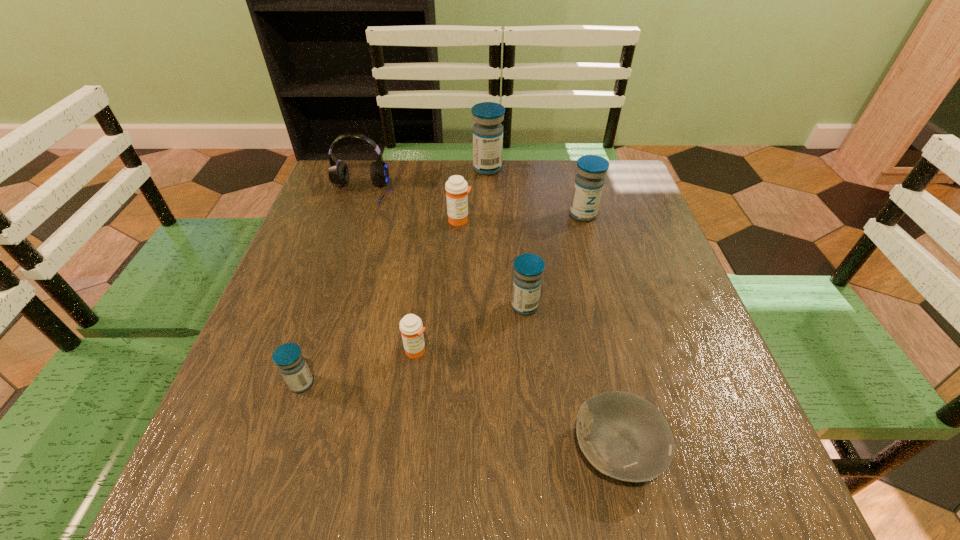
Select which medicine appears as the second closest to the nearest object. Please provide its 2D coordinates. Your answer should be formatted as a tuple, i.e. [(x, y)], where the tuple contains the x and y coordinates of a point satisfying the conditions above.

[(411, 327)]

Point out which blue medicine is positioned as the fourth nearest to the gray bowl. Please provide its 2D coordinates. Your answer should be formatted as a tuple, i.e. [(x, y)], where the tuple contains the x and y coordinates of a point satisfying the conditions above.

[(487, 131)]

Locate an element on the screen. The width and height of the screenshot is (960, 540). blue medicine that stands as the closest to the farther orange medicine is located at coordinates (487, 131).

Locate an element on the screen. The width and height of the screenshot is (960, 540). free space that satisfies the following two spatial constraints: 1. on the back side of the rightmost medicine; 2. on the left side of the shortest object is located at coordinates (564, 214).

Where is `free region that satisfies the following two spatial constraints: 1. on the ear cushions of the left orange medicine; 2. on the right side of the headset`? This screenshot has width=960, height=540. free region that satisfies the following two spatial constraints: 1. on the ear cushions of the left orange medicine; 2. on the right side of the headset is located at coordinates (306, 350).

Find the location of a particular element. The image size is (960, 540). vacant region that satisfies the following two spatial constraints: 1. on the ear cushions of the right orange medicine; 2. on the left side of the headset is located at coordinates (350, 220).